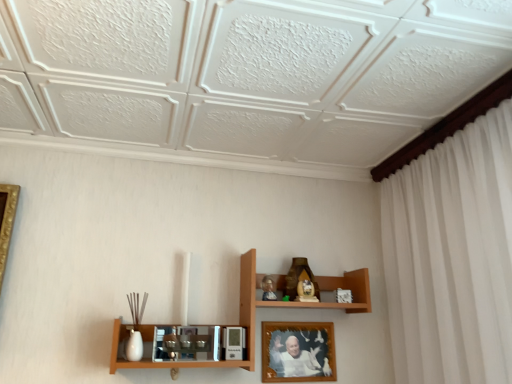
Measure the distance between point [297,342] and camera.

The distance of point [297,342] from camera is 6.03 feet.

What is the approximate width of wooden photo frame at center?

0.55 inches.

Where is `wooden photo frame at center`? The image size is (512, 384). wooden photo frame at center is located at coordinates (297, 351).

Is matte brown statue at upper center not within wooden shelf at center?

No, matte brown statue at upper center is not outside of wooden shelf at center.

Which of these two, matte brown statue at upper center or wooden shelf at center, is wider?

wooden shelf at center.

Does matte brown statue at upper center have a smaller size compared to wooden shelf at center?

Correct, matte brown statue at upper center occupies less space than wooden shelf at center.

Are matte brown statue at upper center and wooden shelf at center beside each other?

No, matte brown statue at upper center is not beside wooden shelf at center.

Is matte brown statue at upper center aimed at wooden photo frame at center?

No, matte brown statue at upper center is not aimed at wooden photo frame at center.

Is point (294, 257) positioned in front of point (312, 327)?

No, (294, 257) is behind (312, 327).

Considering the relative sizes of matte brown statue at upper center and wooden photo frame at center in the image provided, is matte brown statue at upper center thinner than wooden photo frame at center?

In fact, matte brown statue at upper center might be wider than wooden photo frame at center.

Is matte brown statue at upper center bigger than wooden photo frame at center?

Indeed, matte brown statue at upper center has a larger size compared to wooden photo frame at center.

Which of these two, wooden photo frame at center or matte brown statue at upper center, is thinner?

Thinner between the two is wooden photo frame at center.

Locate an element on the screen. Image resolution: width=512 pixels, height=384 pixels. picture frame in front of the matte brown statue at upper center is located at coordinates (297, 351).

Could you tell me if wooden photo frame at center is facing matte brown statue at upper center?

No, wooden photo frame at center is not facing towards matte brown statue at upper center.

Can you confirm if wooden photo frame at center is bigger than matte brown statue at upper center?

Incorrect, wooden photo frame at center is not larger than matte brown statue at upper center.

Considering the positions of objects wooden photo frame at center and wooden shelf at center in the image provided, who is behind, wooden photo frame at center or wooden shelf at center?

wooden photo frame at center.

Measure the distance between wooden photo frame at center and wooden shelf at center.

wooden photo frame at center and wooden shelf at center are 8.06 inches apart from each other.

Which of these two, wooden photo frame at center or wooden shelf at center, is smaller?

wooden photo frame at center.

In the scene shown: Considering the sizes of wooden shelf at center and matte brown statue at upper center in the image, is wooden shelf at center wider or thinner than matte brown statue at upper center?

Considering their sizes, wooden shelf at center looks broader than matte brown statue at upper center.

From the image's perspective, which object appears higher, wooden shelf at center or matte brown statue at upper center?

matte brown statue at upper center.

Does wooden shelf at center have a greater height compared to matte brown statue at upper center?

Yes.

Which point is more distant from viewer, (246,297) or (318,290)?

Positioned behind is point (318,290).

From the image's perspective, which is above, wooden shelf at center or wooden photo frame at center?

wooden shelf at center is shown above in the image.

Can you confirm if wooden shelf at center is positioned to the right of wooden photo frame at center?

Incorrect, wooden shelf at center is not on the right side of wooden photo frame at center.

Is wooden shelf at center next to wooden photo frame at center and touching it?

No, wooden shelf at center is not making contact with wooden photo frame at center.

The height and width of the screenshot is (384, 512). Find the location of `shelf located underneath the matte brown statue at upper center (from a real-world perspective)`. shelf located underneath the matte brown statue at upper center (from a real-world perspective) is located at coordinates (239, 324).

Find the location of `toy to the right of wooden photo frame at center`. toy to the right of wooden photo frame at center is located at coordinates (298, 276).

Based on their spatial positions, is wooden shelf at center or wooden photo frame at center closer to matte brown statue at upper center?

wooden shelf at center.

Estimate the real-world distances between objects in this image. Which object is further from wooden shelf at center, matte brown statue at upper center or wooden photo frame at center?

Among the two, matte brown statue at upper center is located further to wooden shelf at center.

Looking at the image, which one is located further to wooden shelf at center, wooden photo frame at center or matte brown statue at upper center?

matte brown statue at upper center.

Based on the photo, estimate the real-world distances between objects in this image. Which object is further from matte brown statue at upper center, wooden photo frame at center or wooden shelf at center?

The object further to matte brown statue at upper center is wooden photo frame at center.

Which object lies nearer to the anchor point wooden photo frame at center, wooden shelf at center or matte brown statue at upper center?

Based on the image, wooden shelf at center appears to be nearer to wooden photo frame at center.

Considering their positions, is matte brown statue at upper center positioned further to wooden photo frame at center than wooden shelf at center?

Among the two, matte brown statue at upper center is located further to wooden photo frame at center.

Where is `picture frame between wooden shelf at center and matte brown statue at upper center along the z-axis`? The width and height of the screenshot is (512, 384). picture frame between wooden shelf at center and matte brown statue at upper center along the z-axis is located at coordinates (297, 351).